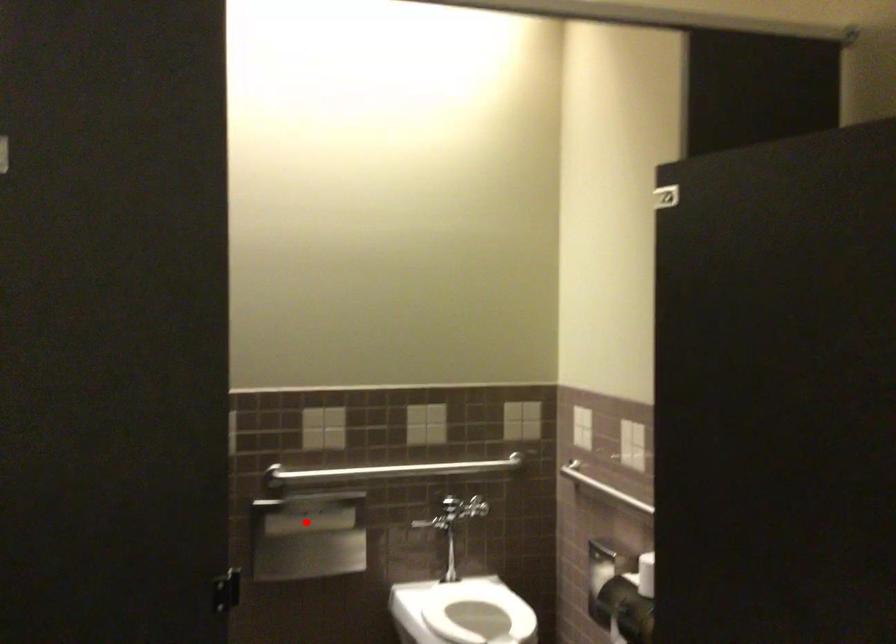
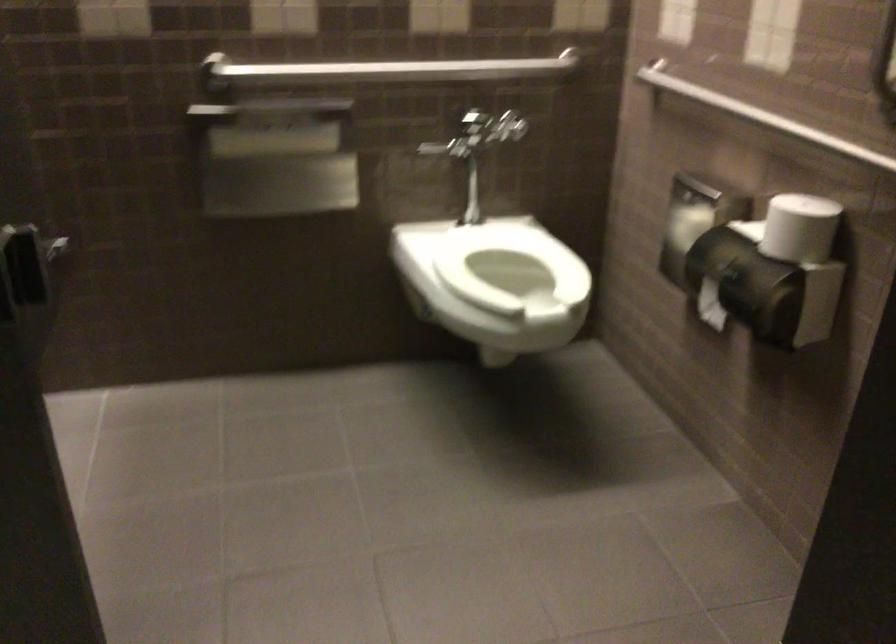
Question: I am providing you with two images of the same scene from different viewpoints. A red point is shown in image1. For the corresponding object point in image2, is it positioned nearer or farther from the camera?

Choices:
 (A) Nearer
 (B) Farther

Answer: (A)